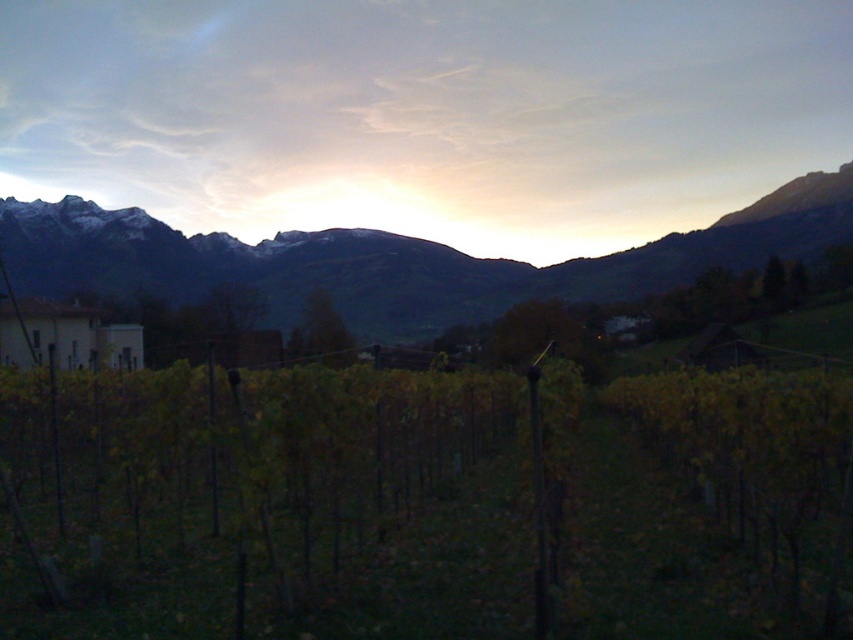
You are an artist planning to paint the landscape. You want to ensure the green leafy vineyard at center and the rocky brown mountain range at center are proportionally accurate. Which object should you paint first to maintain the correct size relationship between them?

You should paint the rocky brown mountain range at center first because it occupies more space than the green leafy vineyard at center, as per the description. This ensures you allocate enough area for the larger feature before detailing the smaller one.

You are a photographer planning to take a landscape photo of the green leafy vineyard at center and the rocky brown mountain range at center. Which of the two objects would appear narrower in the photo?

The green leafy vineyard at center appears narrower in the photo because it is thinner than the rocky brown mountain range at center.